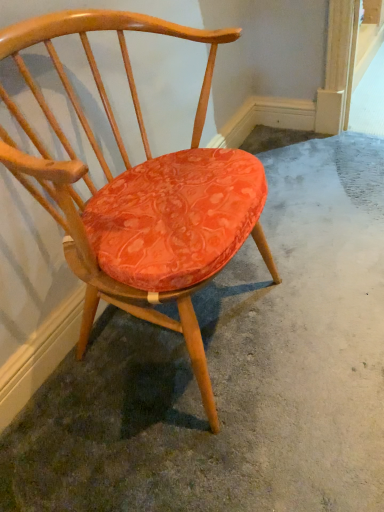
Question: Is matte orange cushioned chair at center smaller than orange fabric cushion at center?

Choices:
 (A) yes
 (B) no

Answer: (B)

Question: Does matte orange cushioned chair at center have a greater height compared to orange fabric cushion at center?

Choices:
 (A) no
 (B) yes

Answer: (B)

Question: Does matte orange cushioned chair at center come behind orange fabric cushion at center?

Choices:
 (A) yes
 (B) no

Answer: (B)

Question: From a real-world perspective, is matte orange cushioned chair at center located higher than orange fabric cushion at center?

Choices:
 (A) no
 (B) yes

Answer: (B)

Question: Is matte orange cushioned chair at center at the right side of orange fabric cushion at center?

Choices:
 (A) yes
 (B) no

Answer: (B)

Question: Considering the relative positions of matte orange cushioned chair at center and orange fabric cushion at center in the image provided, is matte orange cushioned chair at center in front of orange fabric cushion at center?

Choices:
 (A) no
 (B) yes

Answer: (B)

Question: From a real-world perspective, is orange fabric cushion at center located higher than matte orange cushioned chair at center?

Choices:
 (A) no
 (B) yes

Answer: (A)

Question: Is matte orange cushioned chair at center inside orange fabric cushion at center?

Choices:
 (A) yes
 (B) no

Answer: (B)

Question: Is orange fabric cushion at center further to the viewer compared to matte orange cushioned chair at center?

Choices:
 (A) no
 (B) yes

Answer: (B)

Question: Is orange fabric cushion at center not inside matte orange cushioned chair at center?

Choices:
 (A) no
 (B) yes

Answer: (B)

Question: Is orange fabric cushion at center positioned in front of matte orange cushioned chair at center?

Choices:
 (A) no
 (B) yes

Answer: (A)

Question: Can you confirm if orange fabric cushion at center is bigger than matte orange cushioned chair at center?

Choices:
 (A) no
 (B) yes

Answer: (A)

Question: From a real-world perspective, is orange fabric cushion at center positioned above or below matte orange cushioned chair at center?

Choices:
 (A) below
 (B) above

Answer: (A)